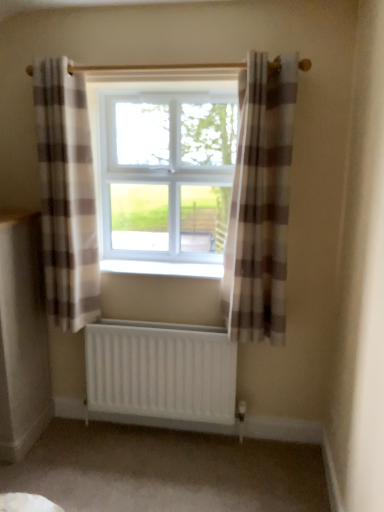
Question: From a real-world perspective, is white plastic radiator at center physically located above or below white matte radiator at lower center?

Choices:
 (A) below
 (B) above

Answer: (B)

Question: Is white plastic radiator at center bigger or smaller than white matte radiator at lower center?

Choices:
 (A) big
 (B) small

Answer: (B)

Question: Based on their relative distances, which object is farther from the plaid fabric curtain at left, placed as the first curtain when sorted from left to right?

Choices:
 (A) white plastic window at center
 (B) plaid fabric curtain at center, which ranks as the first curtain in right-to-left order
 (C) white matte radiator at lower center
 (D) white plastic radiator at center

Answer: (B)

Question: Based on their relative distances, which object is nearer to the plaid fabric curtain at left, the 2th curtain from the right?

Choices:
 (A) white plastic radiator at center
 (B) plaid fabric curtain at center, which ranks as the first curtain in right-to-left order
 (C) white plastic window at center
 (D) white matte radiator at lower center

Answer: (C)